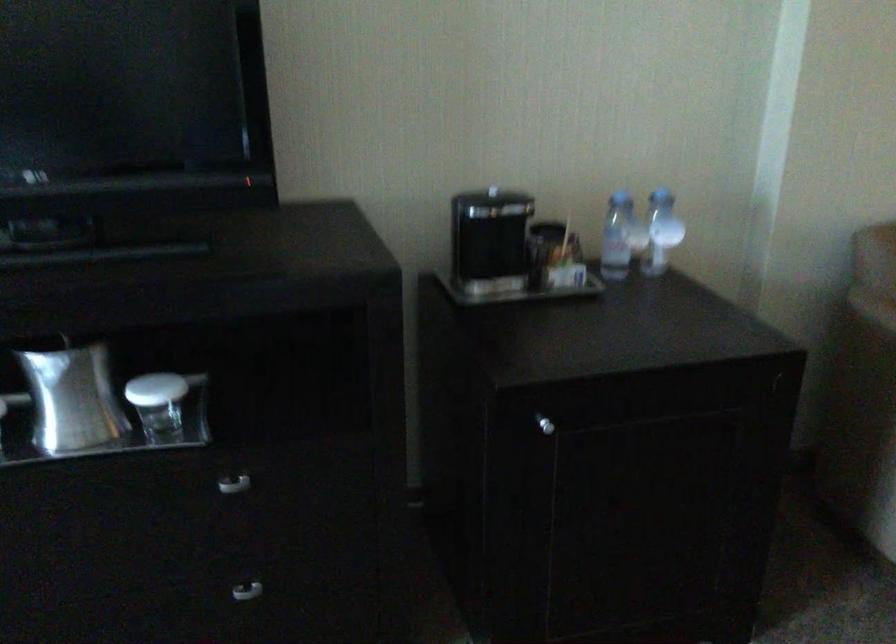
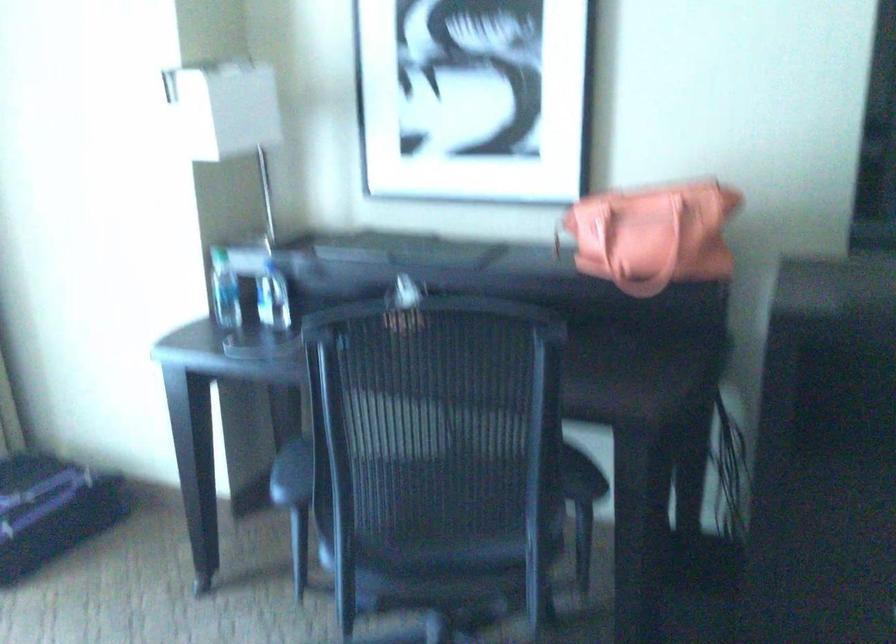
Question: The camera is either moving clockwise (left) or counter-clockwise (right) around the object. The first image is from the beginning of the video and the second image is from the end. Is the camera moving left or right when shooting the video?

Choices:
 (A) Left
 (B) Right

Answer: (B)